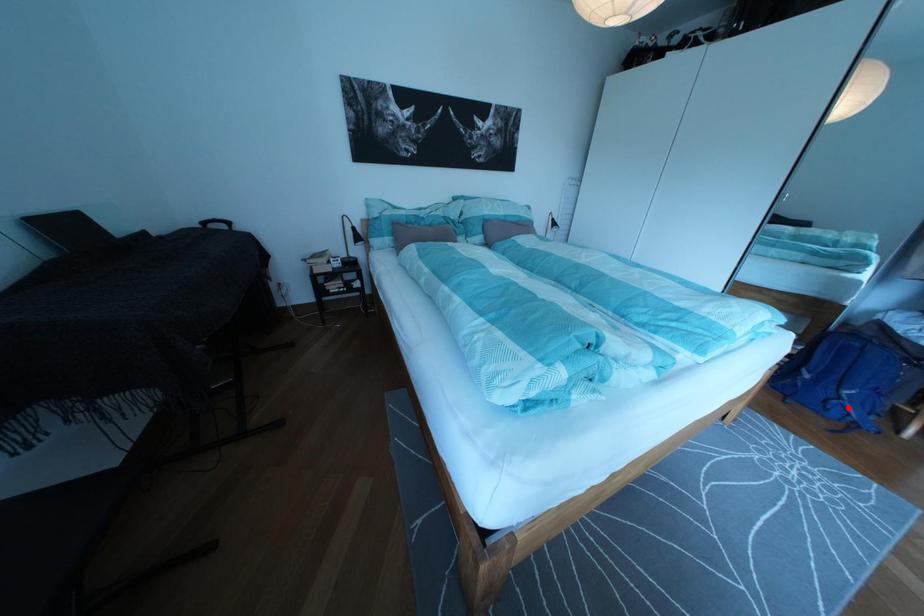
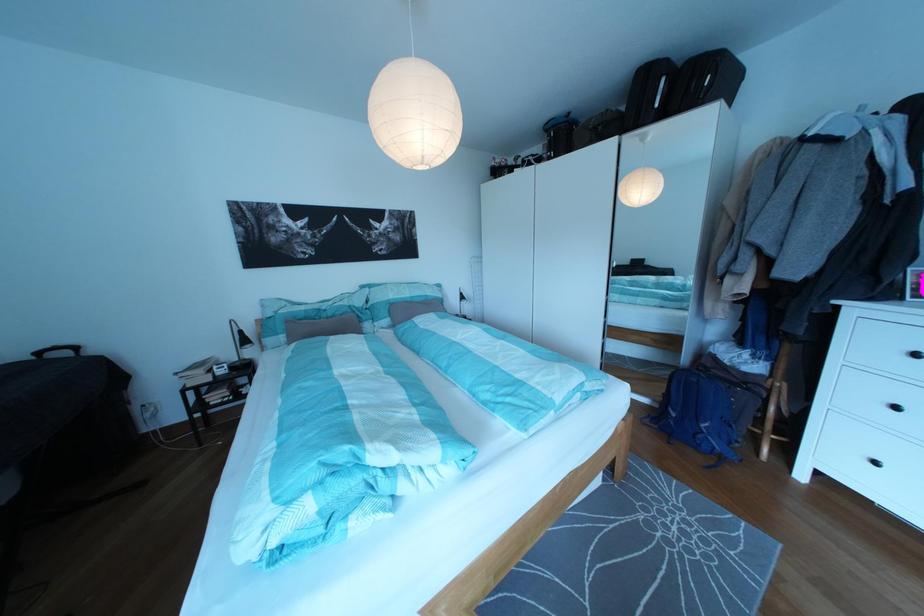
Question: A red point is marked in image1. In image2, is the corresponding 3D point closer to the camera or farther? Reply with the corresponding letter.

Choices:
 (A) The corresponding 3D point is closer.
 (B) The corresponding 3D point is farther.

Answer: (B)